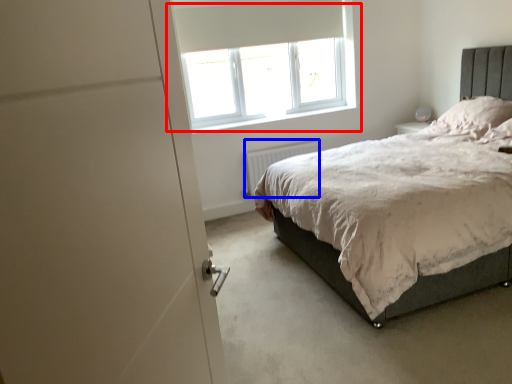
Question: Among these objects, which one is farthest to the camera, window (highlighted by a red box) or radiator (highlighted by a blue box)?

Choices:
 (A) window
 (B) radiator

Answer: (B)